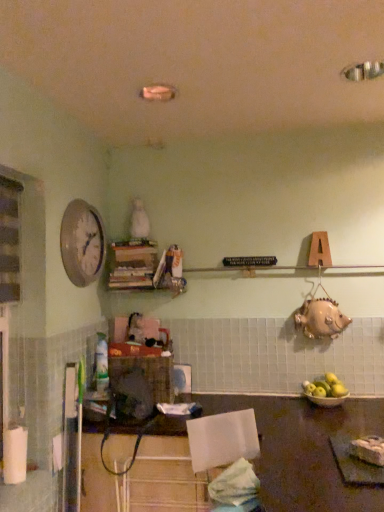
Find the location of a particular element. The image size is (384, 512). white glossy clock at upper left is located at coordinates (82, 243).

What do you see at coordinates (143, 267) in the screenshot? I see `wooden books at center` at bounding box center [143, 267].

The image size is (384, 512). Describe the element at coordinates (325, 387) in the screenshot. I see `yellow matte apple at lower right` at that location.

What is the approximate width of yellow matte apple at lower right?

yellow matte apple at lower right is 8.91 inches in width.

Identify the location of white matte paper towel at lower left. The image size is (384, 512). (15, 455).

Where is `white glossy clock at upper left`? The height and width of the screenshot is (512, 384). white glossy clock at upper left is located at coordinates click(x=82, y=243).

You are a GUI agent. You are given a task and a screenshot of the screen. Output one action in this format:
    pyautogui.click(x=<x>, y=<y>)
    Task: Click on the paper towel that appears on the left of wooden books at center
    The width and height of the screenshot is (384, 512).
    Given the screenshot: What is the action you would take?
    pyautogui.click(x=15, y=455)

Is wooden books at center to the left or to the right of white matte paper towel at lower left in the image?

Based on their positions, wooden books at center is located to the right of white matte paper towel at lower left.

In the scene shown: Considering the relative sizes of wooden books at center and white matte paper towel at lower left in the image provided, is wooden books at center thinner than white matte paper towel at lower left?

No, wooden books at center is not thinner than white matte paper towel at lower left.

From the image's perspective, would you say wooden books at center is shown under white matte paper towel at lower left?

No, from the image's perspective, wooden books at center is not beneath white matte paper towel at lower left.

Looking at this image, which object is further away from the camera, wooden books at center or wooden table at lower center?

wooden books at center is further away from the camera.

At what (x,y) coordinates should I click in order to perform the action: click on shelf that is above the wooden table at lower center (from a real-world perspective). Please return your answer as a coordinate pair (x, y). This screenshot has width=384, height=512. Looking at the image, I should click on pyautogui.click(x=143, y=267).

Is wooden books at center facing away from wooden table at lower center?

wooden books at center is not turned away from wooden table at lower center.

In terms of size, does wooden books at center appear bigger or smaller than wooden table at lower center?

Clearly, wooden books at center is smaller in size than wooden table at lower center.

The height and width of the screenshot is (512, 384). I want to click on shelf located on the right of white glossy clock at upper left, so click(x=143, y=267).

Is white glossy clock at upper left taller than wooden books at center?

Correct, white glossy clock at upper left is much taller as wooden books at center.

Is white glossy clock at upper left inside or outside of wooden books at center?

The correct answer is: outside.

Is wooden table at lower center bigger than wooden books at center?

Yes, wooden table at lower center is bigger than wooden books at center.

Considering the positions of objects wooden table at lower center and wooden books at center in the image provided, who is more to the right, wooden table at lower center or wooden books at center?

wooden table at lower center.

Considering the positions of objects wooden table at lower center and wooden books at center in the image provided, who is behind, wooden table at lower center or wooden books at center?

wooden books at center.

Does point (328, 479) appear closer or farther from the camera than point (144, 283)?

Point (328, 479) is positioned closer to the camera compared to point (144, 283).

Considering the sizes of objects white glossy clock at upper left and yellow matte apple at lower right in the image provided, who is smaller, white glossy clock at upper left or yellow matte apple at lower right?

yellow matte apple at lower right.

Is white glossy clock at upper left looking in the opposite direction of yellow matte apple at lower right?

That's not correct — white glossy clock at upper left is not looking away from yellow matte apple at lower right.

Is yellow matte apple at lower right surrounded by white glossy clock at upper left?

No, yellow matte apple at lower right is not a part of white glossy clock at upper left.

Considering the positions of objects white glossy clock at upper left and yellow matte apple at lower right in the image provided, who is in front, white glossy clock at upper left or yellow matte apple at lower right?

Positioned in front is white glossy clock at upper left.

Who is shorter, yellow matte apple at lower right or wooden books at center?

Standing shorter between the two is yellow matte apple at lower right.

Which of these two, yellow matte apple at lower right or wooden books at center, is thinner?

With smaller width is yellow matte apple at lower right.

Who is smaller, yellow matte apple at lower right or white glossy clock at upper left?

yellow matte apple at lower right.

From a real-world perspective, is yellow matte apple at lower right positioned over white glossy clock at upper left based on gravity?

No, from a real-world perspective, yellow matte apple at lower right is not on top of white glossy clock at upper left.

Can you confirm if yellow matte apple at lower right is taller than white glossy clock at upper left?

No.

Is yellow matte apple at lower right not within white glossy clock at upper left?

Yes.

At what (x,y) coordinates should I click in order to perform the action: click on paper towel in front of the wooden books at center. Please return your answer as a coordinate pair (x, y). Looking at the image, I should click on (15, 455).

At what (x,y) coordinates should I click in order to perform the action: click on table that appears below the wooden books at center (from the image's perspective). Please return your answer as a coordinate pair (x, y). Looking at the image, I should click on (305, 451).

When comparing their distances from wooden table at lower center, does white matte paper towel at lower left or white glossy clock at upper left seem closer?

Based on the image, white matte paper towel at lower left appears to be nearer to wooden table at lower center.

Which object lies further to the anchor point white matte paper towel at lower left, wooden table at lower center or wooden books at center?

wooden table at lower center lies further to white matte paper towel at lower left than the other object.

In the scene shown: Which object lies further to the anchor point white matte paper towel at lower left, wooden books at center or yellow matte apple at lower right?

yellow matte apple at lower right is positioned further to the anchor white matte paper towel at lower left.

Considering their positions, is white matte paper towel at lower left positioned further to white glossy clock at upper left than wooden table at lower center?

wooden table at lower center lies further to white glossy clock at upper left than the other object.

Looking at the image, which one is located further to wooden books at center, wooden table at lower center or yellow matte apple at lower right?

Based on the image, yellow matte apple at lower right appears to be further to wooden books at center.

From the image, which object appears to be nearer to yellow matte apple at lower right, white glossy clock at upper left or white matte paper towel at lower left?

white glossy clock at upper left is positioned closer to the anchor yellow matte apple at lower right.

From the image, which object appears to be nearer to wooden table at lower center, white matte paper towel at lower left or yellow matte apple at lower right?

Based on the image, yellow matte apple at lower right appears to be nearer to wooden table at lower center.

Estimate the real-world distances between objects in this image. Which object is closer to yellow matte apple at lower right, white glossy clock at upper left or wooden books at center?

wooden books at center lies closer to yellow matte apple at lower right than the other object.

Where is `clock between white matte paper towel at lower left and yellow matte apple at lower right from left to right`? This screenshot has width=384, height=512. clock between white matte paper towel at lower left and yellow matte apple at lower right from left to right is located at coordinates pyautogui.click(x=82, y=243).

This screenshot has height=512, width=384. I want to click on apple between wooden books at center and wooden table at lower center vertically, so click(325, 387).

Identify the location of shelf between white matte paper towel at lower left and yellow matte apple at lower right. (143, 267).

Where is `paper towel that lies between wooden books at center and wooden table at lower center from top to bottom`? The height and width of the screenshot is (512, 384). paper towel that lies between wooden books at center and wooden table at lower center from top to bottom is located at coordinates (15, 455).